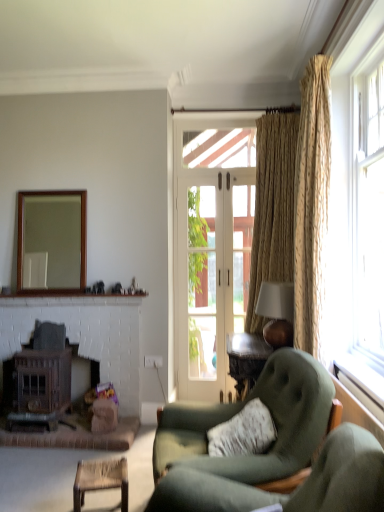
Question: Which is correct: rattan chair at lower left is inside suede green armchair at lower right, or outside of it?

Choices:
 (A) inside
 (B) outside

Answer: (B)

Question: Does point (112, 477) appear closer or farther from the camera than point (162, 455)?

Choices:
 (A) closer
 (B) farther

Answer: (B)

Question: Considering the real-world distances, which object is closest to the rattan chair at lower left?

Choices:
 (A) clear glass door at center
 (B) wooden stove at lower left
 (C) wooden frame mirror at upper left
 (D) translucent glass window at right
 (E) gold textured curtain at right, arranged as the first curtain when viewed from the front

Answer: (B)

Question: Which of these objects is positioned closest to the textured beige curtain at right, which appears as the first curtain when viewed from the back?

Choices:
 (A) wooden stove at lower left
 (B) clear glass door at center
 (C) wooden frame mirror at upper left
 (D) matte brown lampshade at upper right
 (E) translucent glass window at right

Answer: (D)